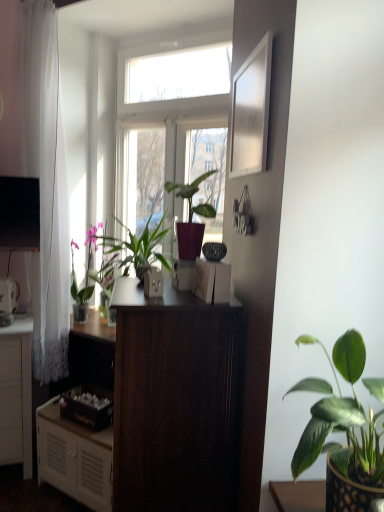
Question: From the image's perspective, relative to white matte cabinet at lower left, is black glossy television at upper left above or below?

Choices:
 (A) above
 (B) below

Answer: (A)

Question: Visually, is black glossy television at upper left positioned to the left or to the right of white matte cabinet at lower left?

Choices:
 (A) right
 (B) left

Answer: (B)

Question: Estimate the real-world distances between objects in this image. Which object is farther from the green glossy leafy plant at lower right, the 1th houseplant viewed from the right?

Choices:
 (A) metallic silver toaster at left, acting as the fifth appliance starting from the right
 (B) matte black speaker at center, the 5th appliance when ordered from left to right
 (C) matte white outlet at center, the fourth appliance when ordered from back to front
 (D) dark wood desk at center
 (E) white glossy picture frame at upper right

Answer: (A)

Question: Based on their relative distances, which object is nearer to the matte black speaker at center, which is the fifth appliance from back to front?

Choices:
 (A) matte green flowerpot at center
 (B) green glossy plant at left, marked as the 3th houseplant in a right-to-left arrangement
 (C) transparent glass window at center
 (D) white glossy coffee maker at center, which is counted as the third appliance, starting from the back
 (E) black glossy television at upper left

Answer: (D)